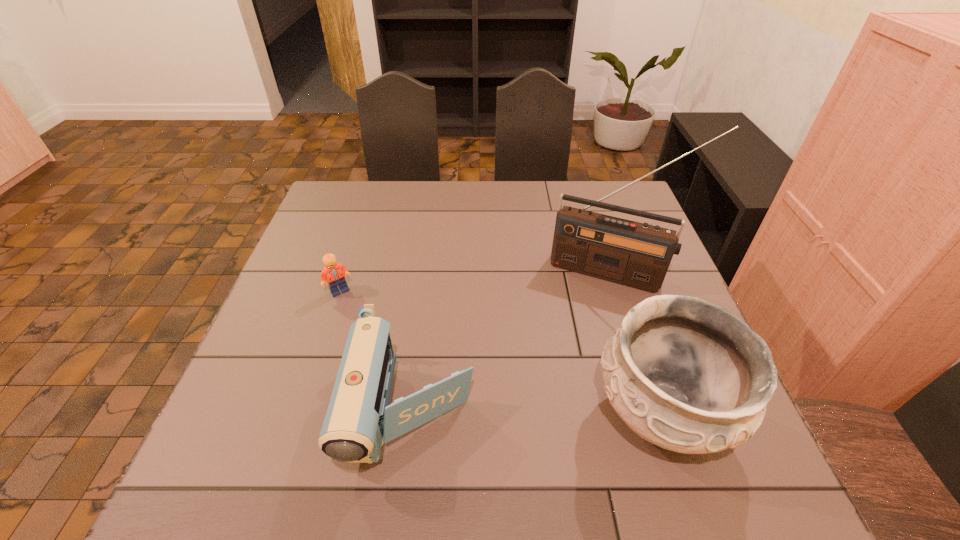
Where is `the third tallest object`? This screenshot has height=540, width=960. the third tallest object is located at coordinates (359, 419).

Locate an element on the screen. Image resolution: width=960 pixels, height=540 pixels. camcorder is located at coordinates (359, 419).

Locate an element on the screen. The height and width of the screenshot is (540, 960). the second tallest object is located at coordinates (689, 376).

Where is `the leftmost object`? the leftmost object is located at coordinates (335, 273).

At what (x,y) coordinates should I click in order to perform the action: click on Lego. Please return your answer as a coordinate pair (x, y). Looking at the image, I should click on (335, 273).

Find the location of `the tallest object`. the tallest object is located at coordinates (637, 255).

Image resolution: width=960 pixels, height=540 pixels. I want to click on vacant space positioned 0.170m on the back of the third shortest object, so click(x=625, y=300).

Locate an element on the screen. vacant space located on the front-facing side of the shortest object is located at coordinates (397, 327).

Locate an element on the screen. The image size is (960, 540). free location located 0.270m on the front-facing side of the shortest object is located at coordinates (429, 347).

The height and width of the screenshot is (540, 960). Identify the location of vacant area situated 0.340m on the front-facing side of the shortest object. (453, 363).